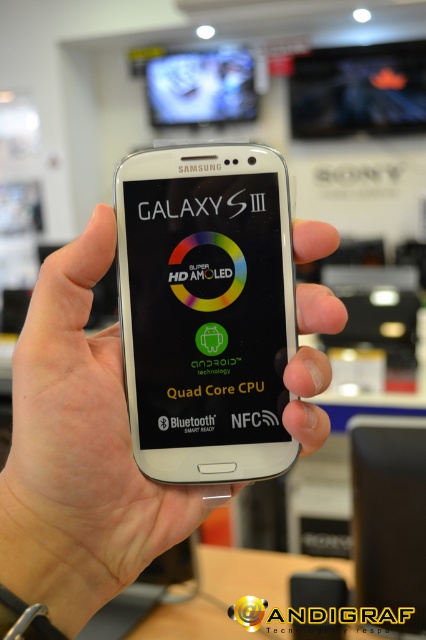
Question: Does white glossy phone at center come in front of white matte phone at center?

Choices:
 (A) no
 (B) yes

Answer: (A)

Question: Does white glossy phone at center appear on the right side of matte black screen at upper center?

Choices:
 (A) yes
 (B) no

Answer: (A)

Question: Does white glossy phone at center lie behind matte black screen at upper center?

Choices:
 (A) no
 (B) yes

Answer: (A)

Question: Which object is farther from the camera taking this photo?

Choices:
 (A) white matte phone at center
 (B) white glossy phone at center

Answer: (B)

Question: Based on their relative distances, which object is farther from the matte black screen at upper center?

Choices:
 (A) white glossy phone at center
 (B) white matte phone at center

Answer: (B)

Question: Which object is farther from the camera taking this photo?

Choices:
 (A) white matte phone at center
 (B) white glossy phone at center

Answer: (B)